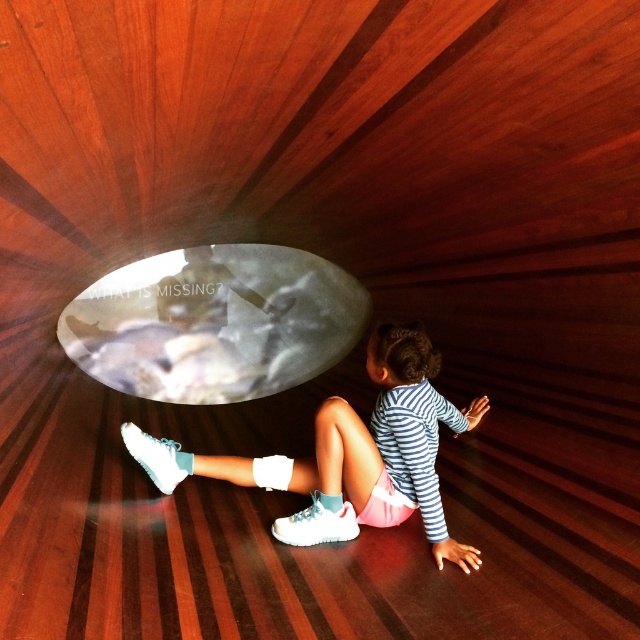
You are a child trying to reach the translucent glass bubble at center from your current position at the white matte sneakers at lower center. Can you stretch your arms and touch it?

The translucent glass bubble at center is 1.36 meters away from the white matte sneakers at lower center. Since the average arm span for a child is around 1.2 meters, the child cannot reach the translucent glass bubble at center with their arms alone.

You are standing in a tunnel with the child and see the translucent glass bubble at center and the white matte sneakers at lower center. Which object is closer to you?

The translucent glass bubble at center is closer to you because it is further to the viewer than the white matte sneakers at lower center.